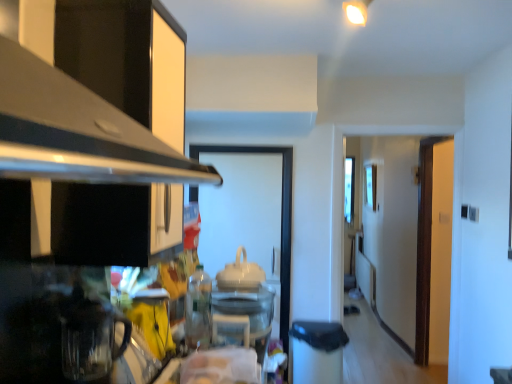
Identify the location of free spot above transparent glass door at center (from a real-world perspective). This screenshot has height=384, width=512. (238, 149).